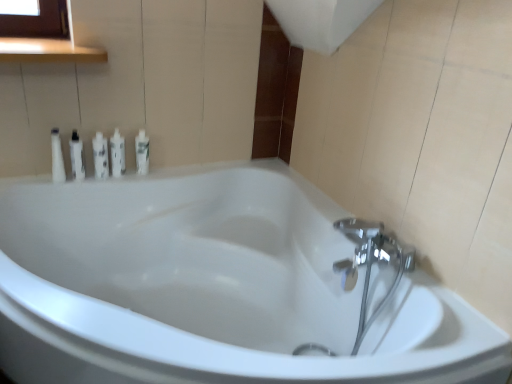
Question: In the image, is white glossy bottle at left, which ranks as the fifth toiletry in right-to-left order, positioned in front of or behind white glossy tube at upper left, the fourth toiletry in the right-to-left sequence?

Choices:
 (A) behind
 (B) front

Answer: (B)

Question: Considering the positions of white glossy bottle at left, which ranks as the fifth toiletry in right-to-left order, and white glossy tube at upper left, the fourth toiletry in the right-to-left sequence, in the image, is white glossy bottle at left, which ranks as the fifth toiletry in right-to-left order, taller or shorter than white glossy tube at upper left, the fourth toiletry in the right-to-left sequence,?

Choices:
 (A) tall
 (B) short

Answer: (A)

Question: Which object is positioned farthest from the white glossy bottle at upper left, positioned as the first toiletry in right-to-left order?

Choices:
 (A) white glossy bathtub at center
 (B) white glossy bottle at upper left, which is the 4th toiletry from left to right
 (C) white glossy bottle at left, the first toiletry positioned from the left
 (D) white glossy tube at upper left, positioned as the 2th toiletry in left-to-right order
 (E) white glossy lotion at center, which ranks as the 3th toiletry in left-to-right order

Answer: (A)

Question: Which object is positioned farthest from the white glossy lotion at center, which ranks as the 3th toiletry in left-to-right order?

Choices:
 (A) white glossy bottle at left, the first toiletry positioned from the left
 (B) white glossy bathtub at center
 (C) white glossy tube at upper left, the fourth toiletry in the right-to-left sequence
 (D) white glossy bottle at upper left, which is counted as the fifth toiletry, starting from the left
 (E) white glossy bottle at upper left, which is the 4th toiletry from left to right

Answer: (B)